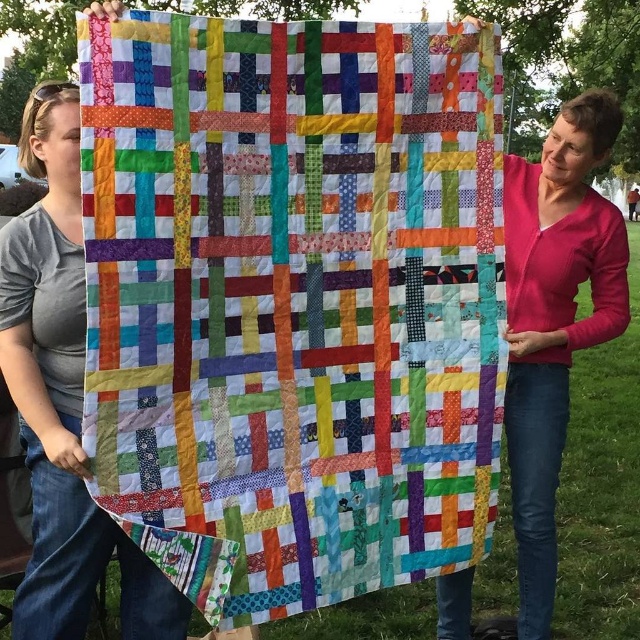
You are standing 5 feet away from the camera and want to take a photo of the quilted fabric quilt at center. Can you reach it without moving closer?

The quilted fabric quilt at center is 5.26 feet away from the camera. Since you are standing 5 feet away from the camera, you are 0.26 feet closer than the quilt, so you can reach it without moving closer.

Consider the image. You are a tailor trying to decide which quilt to display in a narrow storefront window. The window is exactly the width of the matte cotton quilt at left. Can the quilted fabric quilt at center fit in the same window without folding?

The quilted fabric quilt at center might be wider than the matte cotton quilt at left, so there is a possibility it won not fit in the window without folding.

You are standing in front of the two people holding the colorful quilt. There is a specific point marked at coordinates point (120,122). If you want to reach this point without moving closer to the people, can you stretch your arm out to touch it?

The point (120,122) is 1.64 meters away from the viewer. Since the average human arm length is about 0.7 meters, you cannot reach it without moving closer.